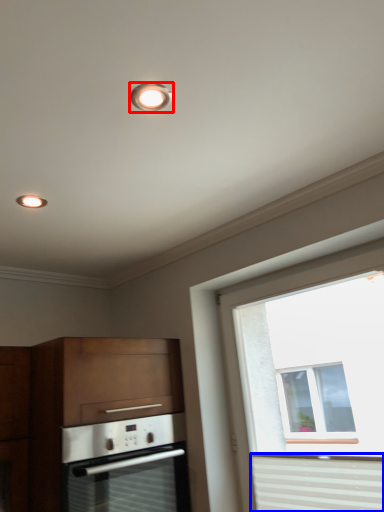
Question: Which object is further to the camera taking this photo, lighting (highlighted by a red box) or curtain (highlighted by a blue box)?

Choices:
 (A) lighting
 (B) curtain

Answer: (B)